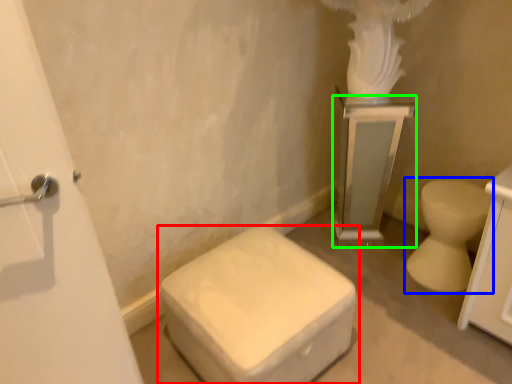
Question: Based on their relative distances, which object is nearer to toilet (highlighted by a red box)? Choose from toilet (highlighted by a blue box) and medicine cabinet (highlighted by a green box).

Choices:
 (A) toilet
 (B) medicine cabinet

Answer: (A)